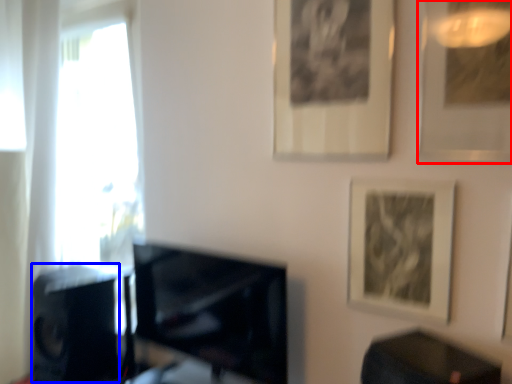
Question: Among these objects, which one is nearest to the camera, picture frame (highlighted by a red box) or speaker (highlighted by a blue box)?

Choices:
 (A) picture frame
 (B) speaker

Answer: (A)